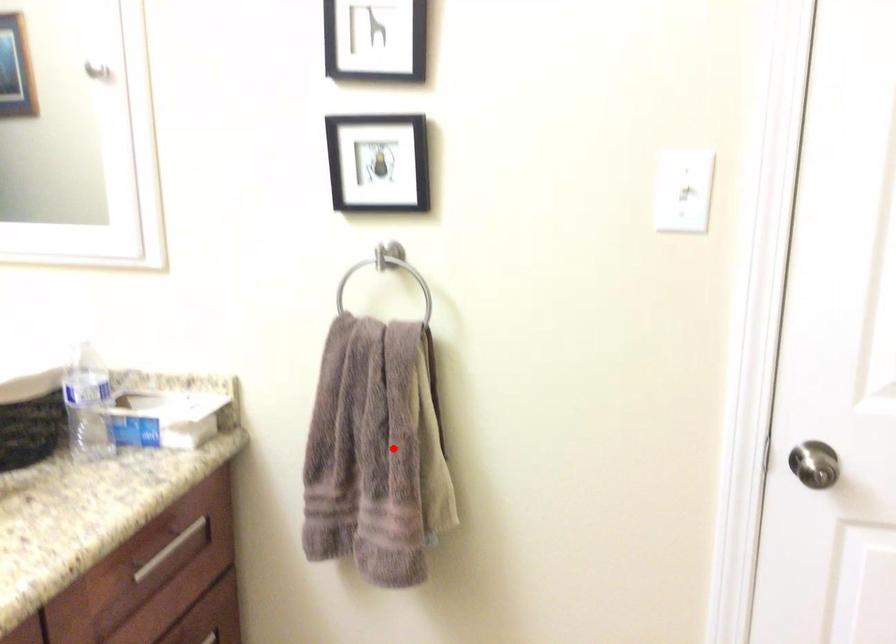
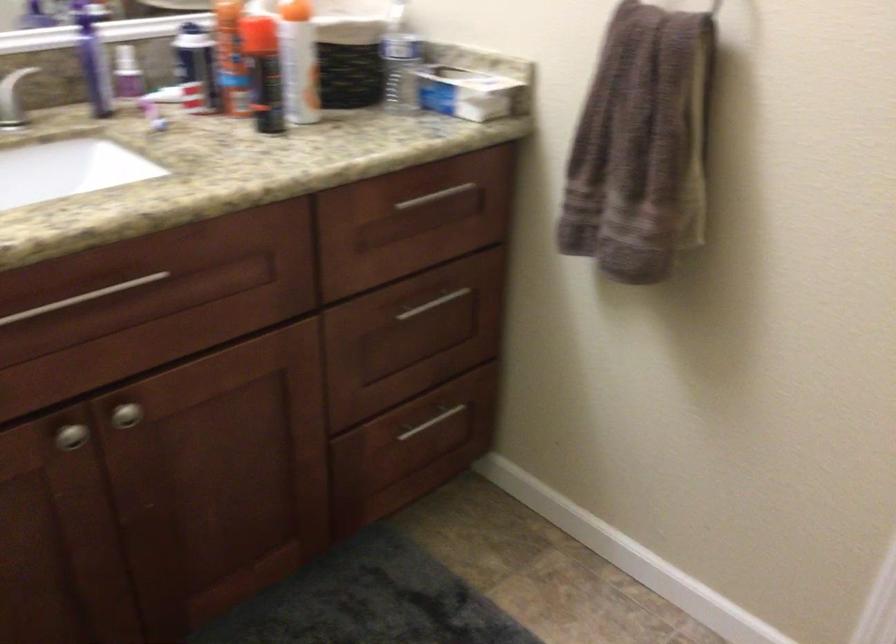
Locate, in the second image, the point that corresponds to the highlighted location in the first image.

(641, 146)